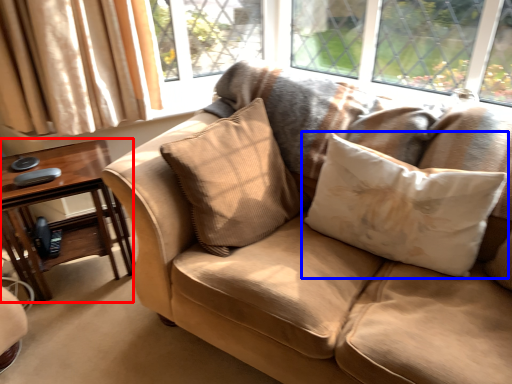
Question: Among these objects, which one is nearest to the camera, table (highlighted by a red box) or pillow (highlighted by a blue box)?

Choices:
 (A) table
 (B) pillow

Answer: (B)